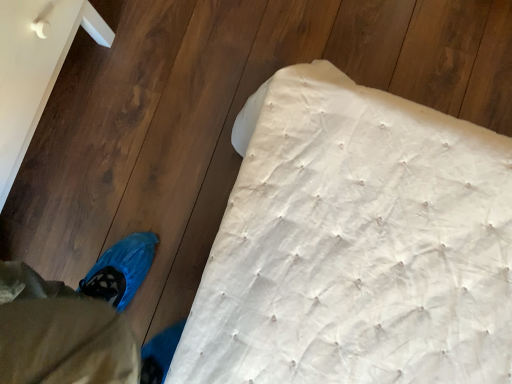
Locate an element on the screen. This screenshot has height=384, width=512. free point in front of blue fabric bag at lower left is located at coordinates (131, 234).